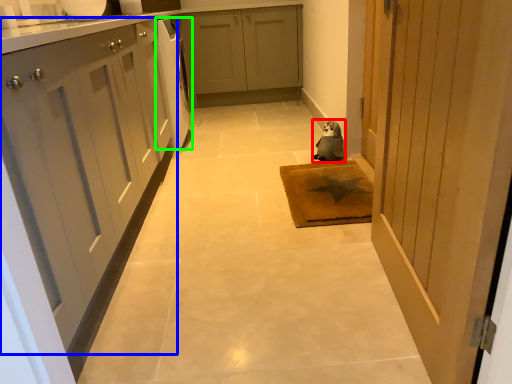
Question: Which object is the closest to the animal (highlighted by a red box)? Choose among these: cabinetry (highlighted by a blue box) or dish washer (highlighted by a green box).

Choices:
 (A) cabinetry
 (B) dish washer

Answer: (B)